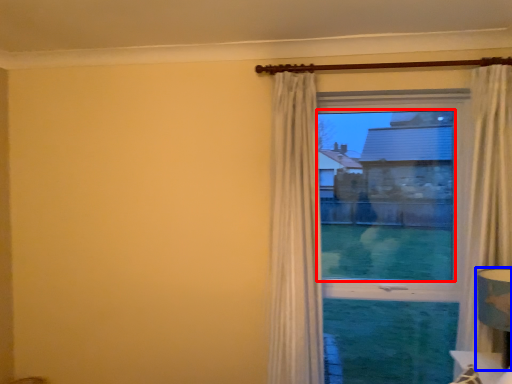
Question: Which object appears closest to the camera in this image, window screen (highlighted by a red box) or table lamp (highlighted by a blue box)?

Choices:
 (A) window screen
 (B) table lamp

Answer: (B)